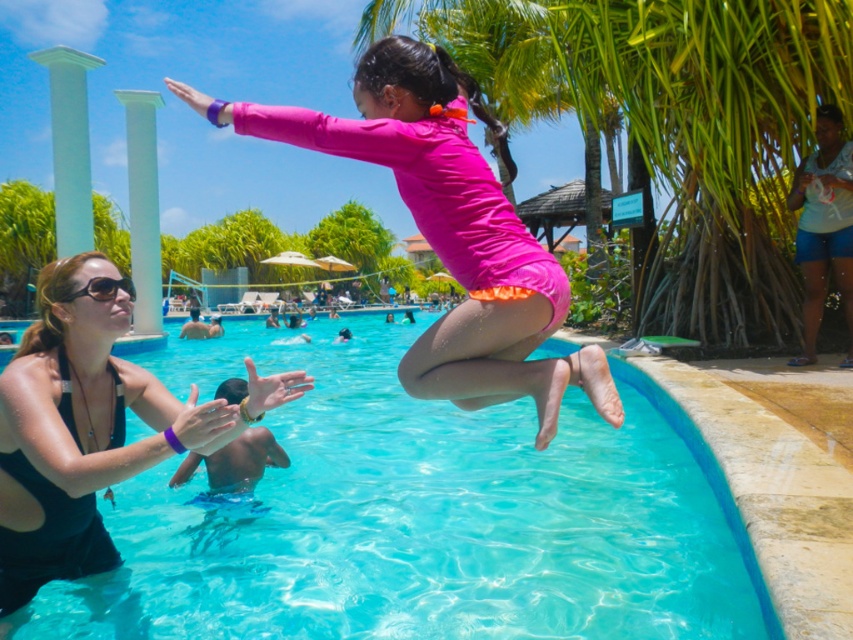
Is point (844, 209) closer to viewer compared to point (123, 276)?

Yes, it is.

Can you confirm if light blue denim shorts at right is smaller than black plastic sunglasses at upper left?

No.

Locate an element on the screen. The width and height of the screenshot is (853, 640). light blue denim shorts at right is located at coordinates (822, 227).

Can you confirm if transparent blue water at center is positioned to the left of black matte swimsuit at left?

Yes, transparent blue water at center is to the left of black matte swimsuit at left.

In order to click on transparent blue water at center in this screenshot , I will do `click(421, 516)`.

Can you confirm if green leafy palm tree at upper center is positioned above black matte swimsuit at left?

Yes, green leafy palm tree at upper center is above black matte swimsuit at left.

Who is more distant from viewer, (596, 97) or (99, 358)?

Positioned behind is point (596, 97).

I want to click on green leafy palm tree at upper center, so click(x=672, y=125).

Where is `green leafy palm tree at upper center`? Image resolution: width=853 pixels, height=640 pixels. green leafy palm tree at upper center is located at coordinates (672, 125).